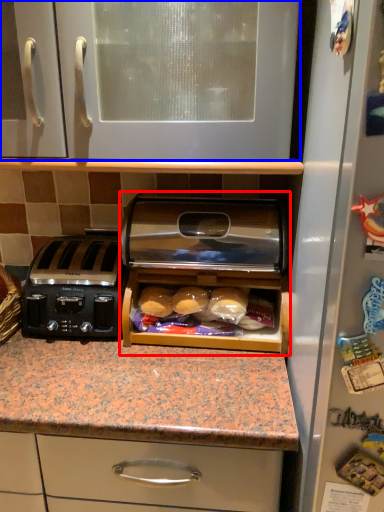
Question: Which point is closer to the camera, home appliance (highlighted by a red box) or cabinetry (highlighted by a blue box)?

Choices:
 (A) home appliance
 (B) cabinetry

Answer: (B)